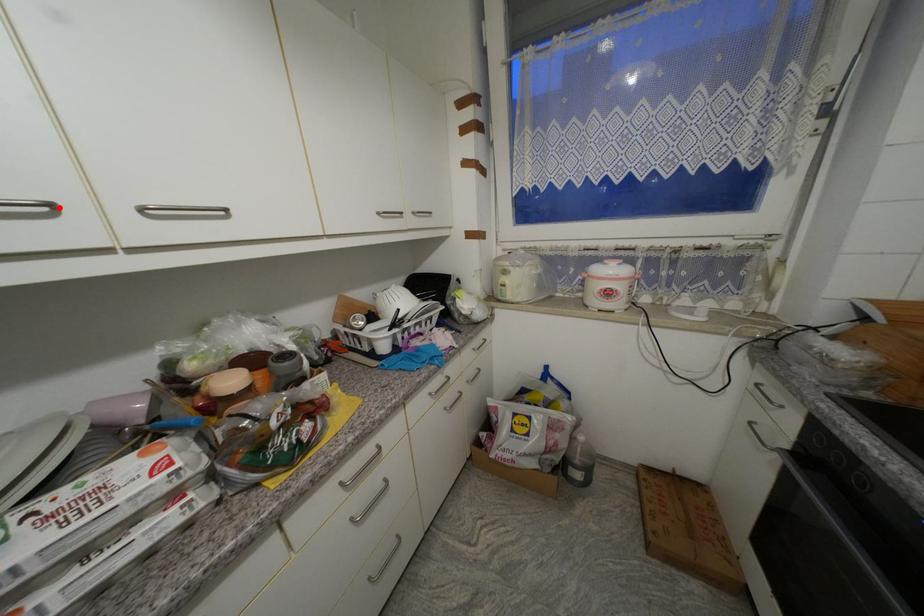
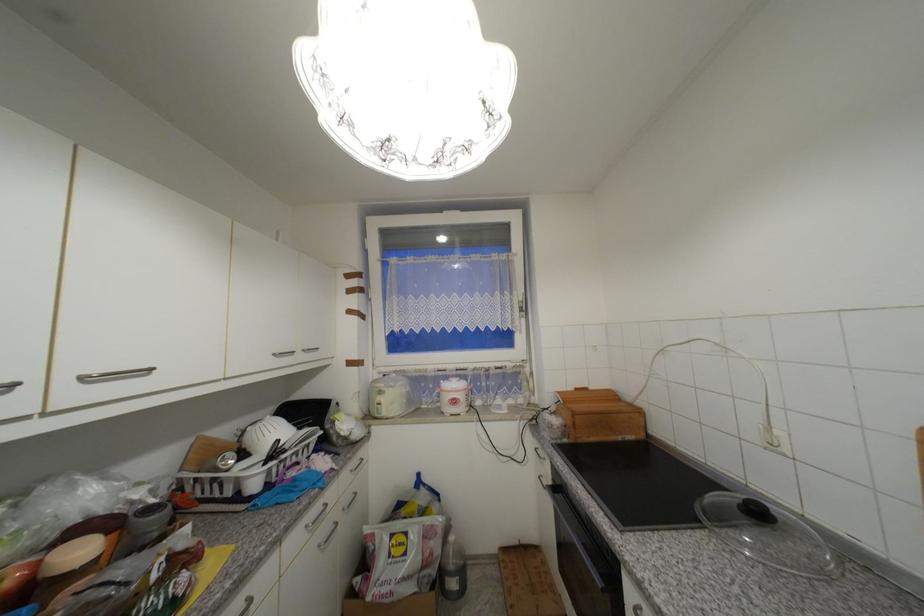
The point at the highlighted location is marked in the first image. Where is the corresponding point in the second image?

(19, 386)